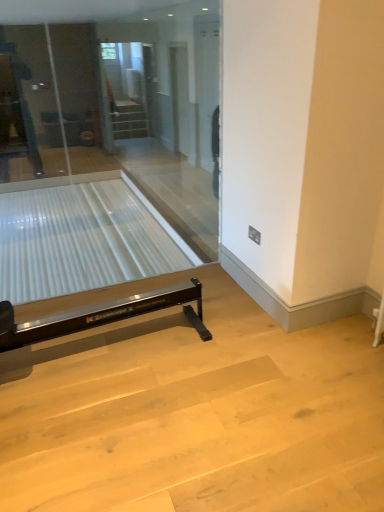
Image resolution: width=384 pixels, height=512 pixels. What are the coordinates of `free point in front of transparent glass door at center` in the screenshot? It's located at (146, 387).